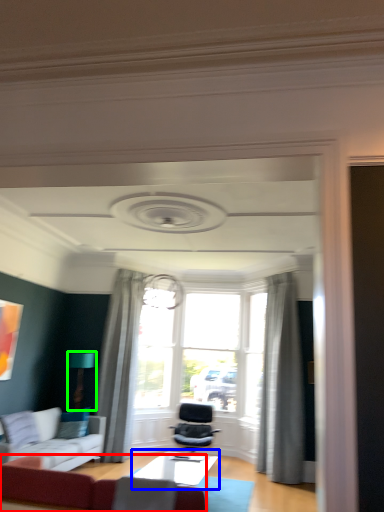
Question: Considering the real-world distances, which object is closest to studio couch (highlighted by a red box)? table (highlighted by a blue box) or light fixture (highlighted by a green box).

Choices:
 (A) table
 (B) light fixture

Answer: (A)